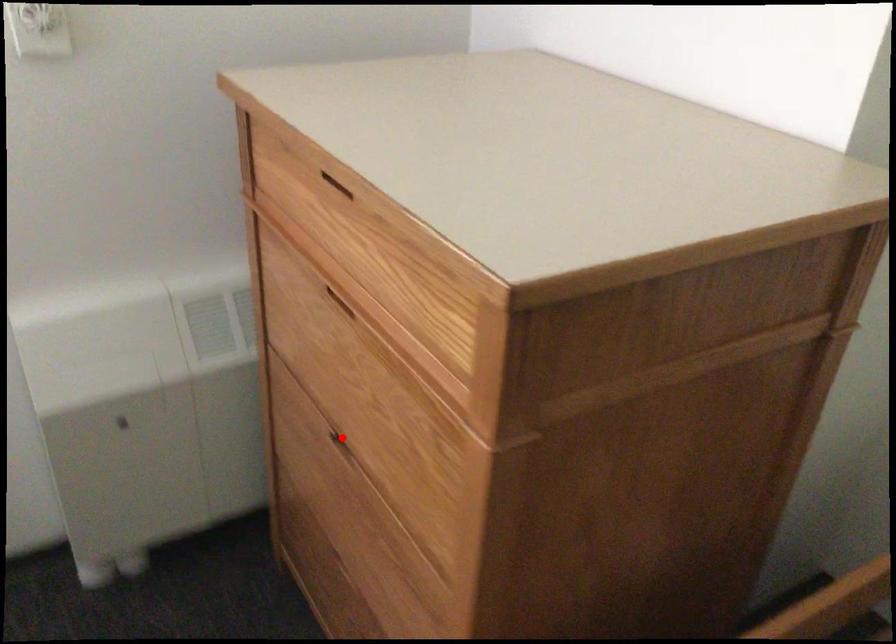
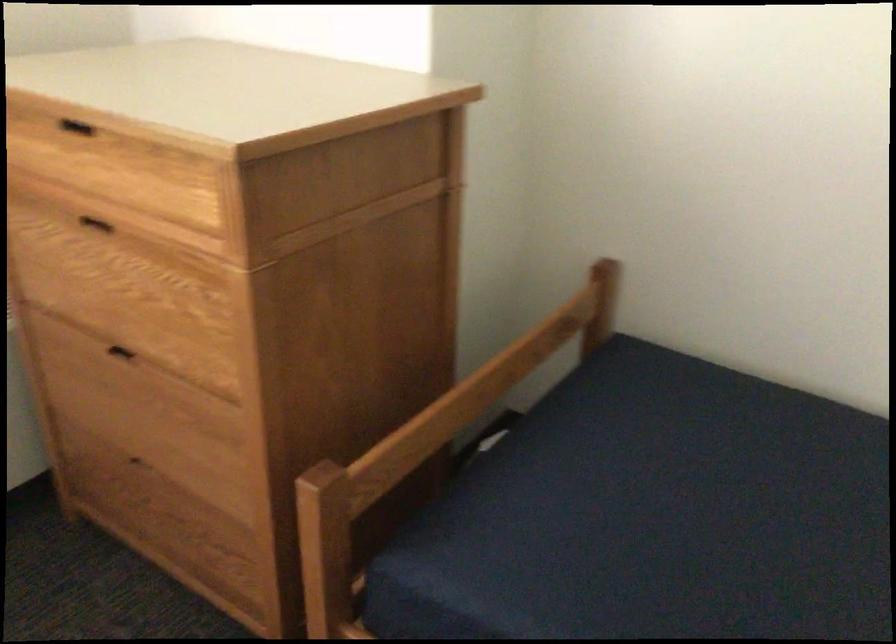
Question: I am providing you with two images of the same scene from different viewpoints. Image1 has a red point marked. In image2, the corresponding 3D location appears at what relative position? Reply with the corresponding letter.

Choices:
 (A) Closer
 (B) Farther

Answer: (B)